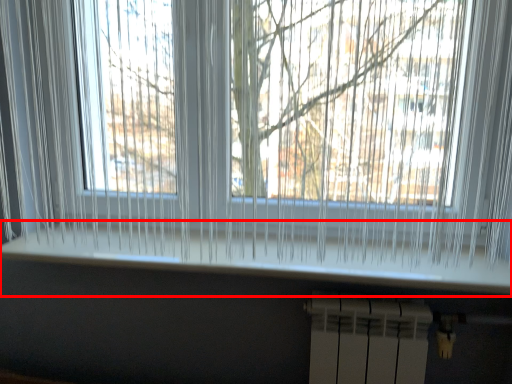
Question: In this image, where is window sill (annotated by the red box) located relative to radiator?

Choices:
 (A) left
 (B) right

Answer: (A)